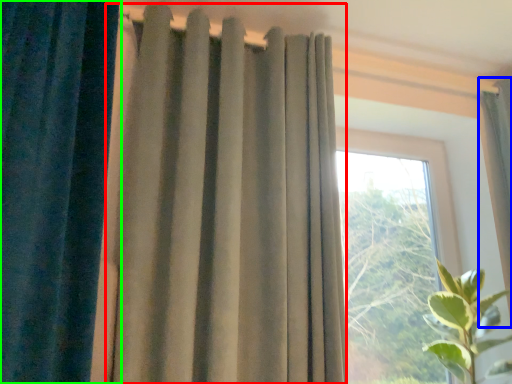
Question: Estimate the real-world distances between objects in this image. Which object is closer to curtain (highlighted by a red box), curtain (highlighted by a blue box) or curtain (highlighted by a green box)?

Choices:
 (A) curtain
 (B) curtain

Answer: (B)